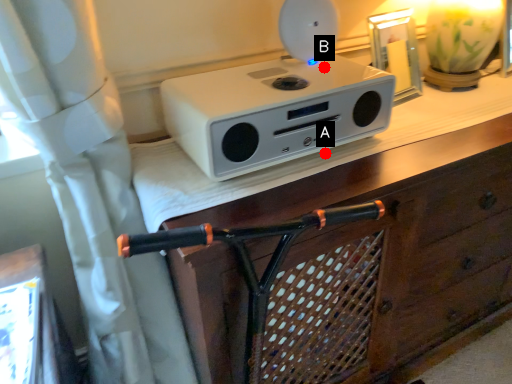
Question: Two points are circled on the image, labeled by A and B beside each circle. Which point appears farthest from the camera in this image?

Choices:
 (A) A is further
 (B) B is further

Answer: (B)